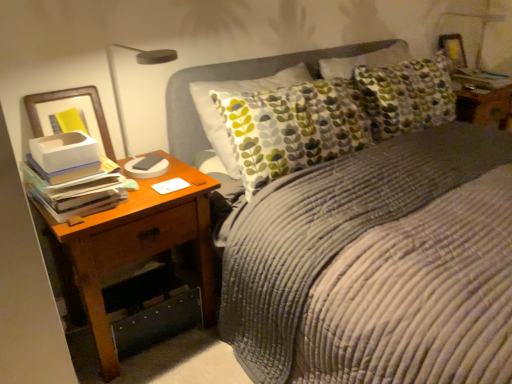
Question: Does white paper stack at left have a smaller size compared to brown wood nightstand at left?

Choices:
 (A) no
 (B) yes

Answer: (B)

Question: From the image's perspective, is white paper stack at left above brown wood nightstand at left?

Choices:
 (A) no
 (B) yes

Answer: (B)

Question: From the image's perspective, would you say white paper stack at left is shown under brown wood nightstand at left?

Choices:
 (A) yes
 (B) no

Answer: (B)

Question: Considering the relative sizes of white paper stack at left and brown wood nightstand at left in the image provided, is white paper stack at left taller than brown wood nightstand at left?

Choices:
 (A) yes
 (B) no

Answer: (B)

Question: Considering the relative sizes of white paper stack at left and brown wood nightstand at left in the image provided, is white paper stack at left thinner than brown wood nightstand at left?

Choices:
 (A) yes
 (B) no

Answer: (A)

Question: Considering the positions of point (70, 195) and point (183, 193), is point (70, 195) closer or farther from the camera than point (183, 193)?

Choices:
 (A) closer
 (B) farther

Answer: (A)

Question: Visually, is white paper stack at left positioned to the left or to the right of brown wood nightstand at left?

Choices:
 (A) right
 (B) left

Answer: (B)

Question: From a real-world perspective, is white paper stack at left physically located above or below brown wood nightstand at left?

Choices:
 (A) above
 (B) below

Answer: (A)

Question: Looking at their shapes, would you say white paper stack at left is wider or thinner than brown wood nightstand at left?

Choices:
 (A) wide
 (B) thin

Answer: (B)

Question: Considering the relative positions of brown wood nightstand at left and white paper stack at left in the image provided, is brown wood nightstand at left to the left or to the right of white paper stack at left?

Choices:
 (A) left
 (B) right

Answer: (B)

Question: Is brown wood nightstand at left inside or outside of white paper stack at left?

Choices:
 (A) outside
 (B) inside

Answer: (A)

Question: In terms of height, does brown wood nightstand at left look taller or shorter compared to white paper stack at left?

Choices:
 (A) short
 (B) tall

Answer: (B)

Question: From the image's perspective, is brown wood nightstand at left located above or below white paper stack at left?

Choices:
 (A) above
 (B) below

Answer: (B)

Question: Is white paper stack at left wider or thinner than corduroy fabric bed at center?

Choices:
 (A) thin
 (B) wide

Answer: (A)

Question: Which is correct: white paper stack at left is inside corduroy fabric bed at center, or outside of it?

Choices:
 (A) inside
 (B) outside

Answer: (B)